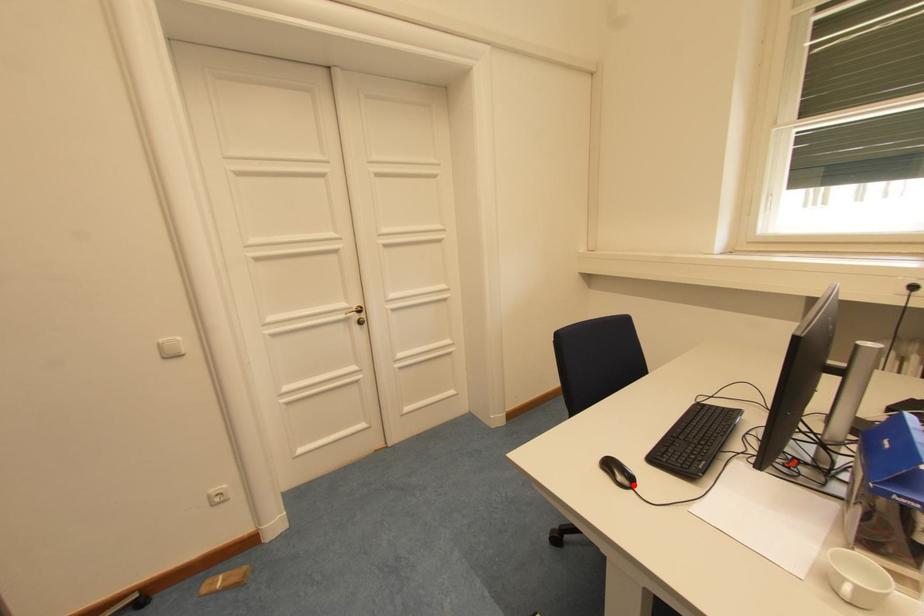
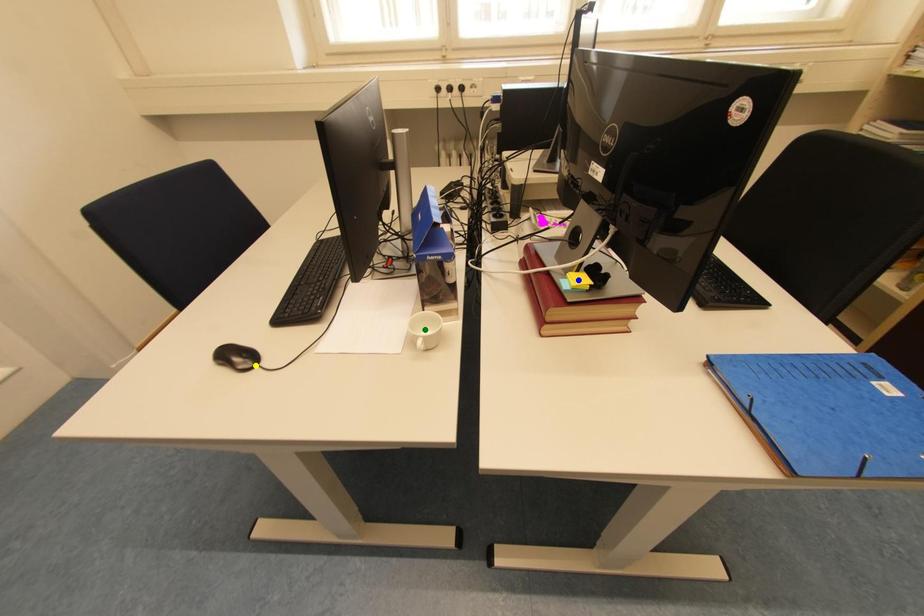
Question: I am providing you with two images of the same scene from different viewpoints. A red point is marked on the first image. You are given multiple points on the second image. Which point in image 2 is actually the same real-world point as the red point in image 1?

Choices:
 (A) yellow point
 (B) green point
 (C) blue point

Answer: (A)